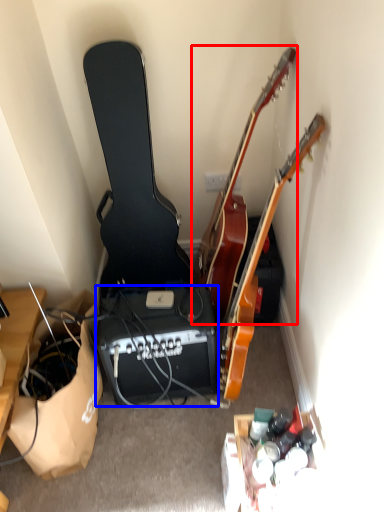
Question: Which object appears closest to the camera in this image, guitar (highlighted by a red box) or speaker (highlighted by a blue box)?

Choices:
 (A) guitar
 (B) speaker

Answer: (A)